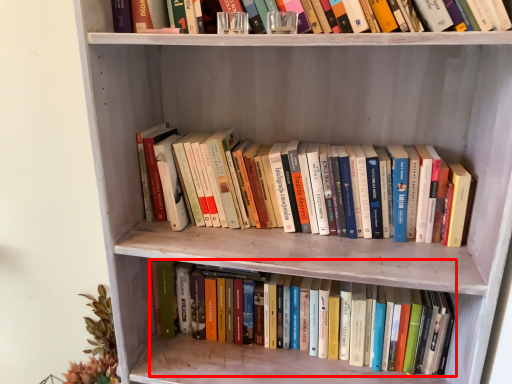
Question: From the image's perspective, what is the correct spatial positioning of book (annotated by the red box) in reference to book?

Choices:
 (A) above
 (B) below

Answer: (B)